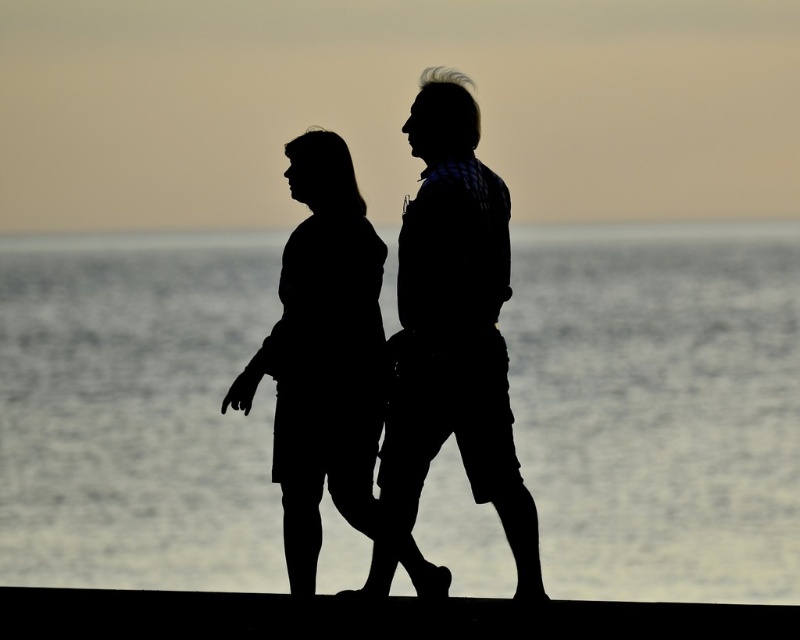
You are a photographer trying to capture the sunset scene with the two figures. Since the transparent water at center and the silhouette shirt at center are both in the frame, which one will appear bigger in your photo?

The transparent water at center will appear bigger in the photo because it is larger in size than the silhouette shirt at center.

You are a photographer trying to capture the scene with the transparent water at center and the black matte figure at center. Which object is located to the left of the other?

The black matte figure at center is to the left of the transparent water at center because the transparent water at center is positioned on the right side of the black matte figure at center.

You are a photographer trying to capture the silhouette shirt at center in the frame. Based on its coordinates, where should you position your camera to ensure it is centered?

The silhouette shirt at center is already positioned at coordinates point (450, 337), so centering the camera on these coordinates would ensure it is captured in the frame.